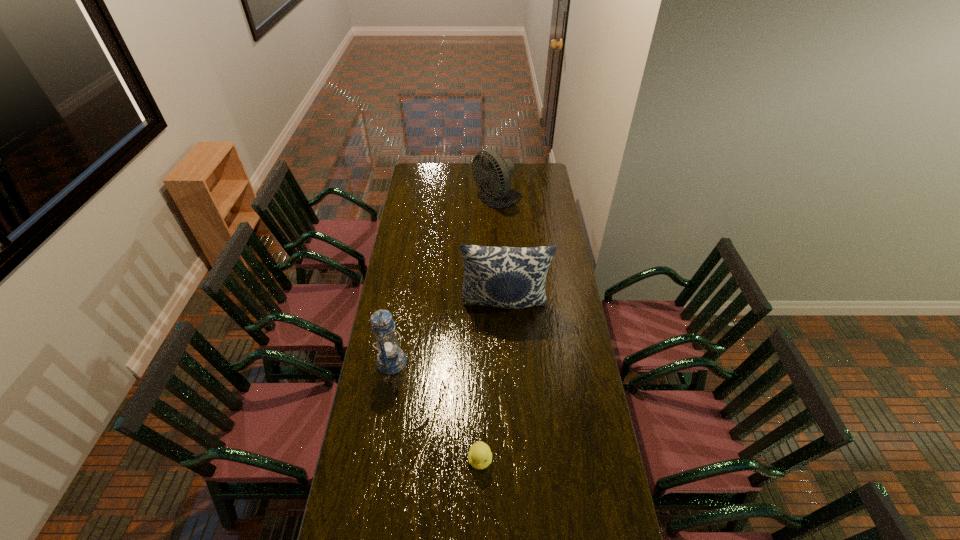
At what (x,y) coordinates should I click in order to perform the action: click on cushion. Please return your answer as a coordinate pair (x, y). Looking at the image, I should click on (508, 277).

At what (x,y) coordinates should I click in order to perform the action: click on the farthest object. Please return your answer as a coordinate pair (x, y). This screenshot has height=540, width=960. Looking at the image, I should click on (494, 179).

You are a GUI agent. You are given a task and a screenshot of the screen. Output one action in this format:
    pyautogui.click(x=<x>, y=<y>)
    Task: Click on the leftmost object
    
    Given the screenshot: What is the action you would take?
    pyautogui.click(x=391, y=359)

Find the location of `the second nearest object`. the second nearest object is located at coordinates (391, 359).

Identify the location of the nearest object. The width and height of the screenshot is (960, 540). (479, 456).

Identify the location of duckling. tap(479, 456).

Find the location of a particular element. free spot located 0.060m on the front surface of the cushion is located at coordinates (507, 331).

This screenshot has width=960, height=540. Identify the location of free space located 0.090m in front of the fan to direct airflow. (457, 200).

The height and width of the screenshot is (540, 960). I want to click on free space located 0.220m in front of the fan to direct airflow, so click(x=436, y=200).

Find the location of `vacant space located in front of the fan to direct airflow`. vacant space located in front of the fan to direct airflow is located at coordinates (457, 200).